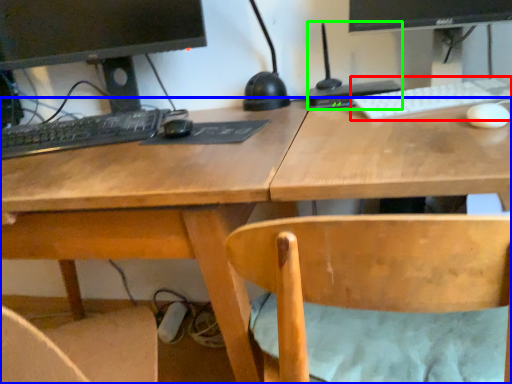
Question: Estimate the real-world distances between objects in this image. Which object is farther from computer keyboard (highlighted by a red box), desk (highlighted by a blue box) or computer (highlighted by a green box)?

Choices:
 (A) desk
 (B) computer

Answer: (A)